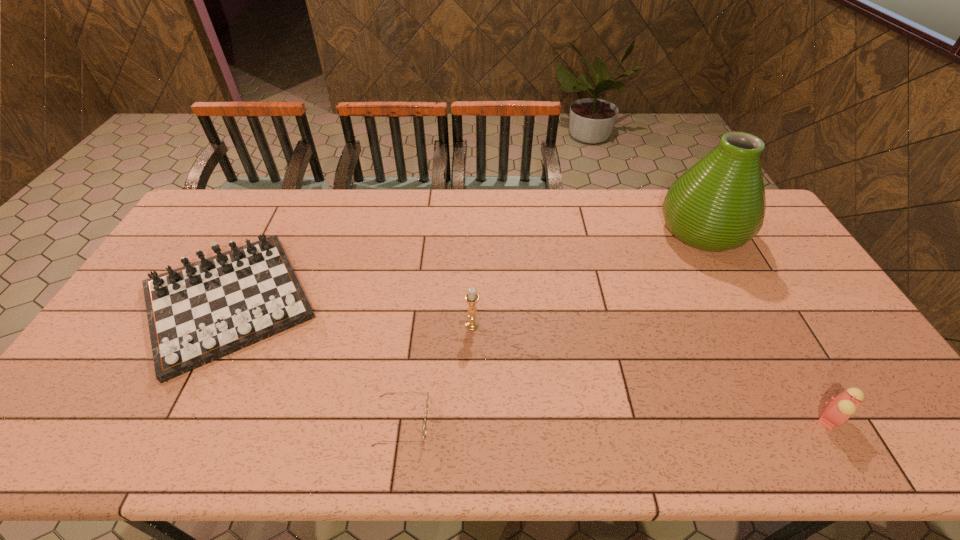
At what (x,y) coordinates should I click in order to perform the action: click on vase. Please return your answer as a coordinate pair (x, y). The image size is (960, 540). Looking at the image, I should click on (718, 204).

Locate an element on the screen. This screenshot has width=960, height=540. the third object from right to left is located at coordinates (471, 297).

Find the location of a particular element. candle holder is located at coordinates (471, 297).

Image resolution: width=960 pixels, height=540 pixels. Find the location of `chessboard`. chessboard is located at coordinates (201, 312).

At what (x,y) coordinates should I click in order to perform the action: click on alarm clock. Please return your answer as a coordinate pair (x, y). The image size is (960, 540). Looking at the image, I should click on (841, 408).

Locate an element on the screen. the shortest object is located at coordinates (426, 411).

You are a GUI agent. You are given a task and a screenshot of the screen. Output one action in this format:
    pyautogui.click(x=<x>, y=<y>)
    Task: Click on the sunglasses
    The width and height of the screenshot is (960, 540).
    Given the screenshot: What is the action you would take?
    pyautogui.click(x=426, y=411)

The height and width of the screenshot is (540, 960). What are the coordinates of `free space located on the right of the vase` in the screenshot? It's located at (761, 231).

You are a GUI agent. You are given a task and a screenshot of the screen. Output one action in this format:
    pyautogui.click(x=<x>, y=<y>)
    Task: Click on the blank space located 0.070m on the front of the candle holder
    This screenshot has height=540, width=960.
    Given the screenshot: What is the action you would take?
    pyautogui.click(x=472, y=352)

The image size is (960, 540). What are the coordinates of `vacant space located 0.360m on the right of the chessboard` in the screenshot? It's located at (444, 301).